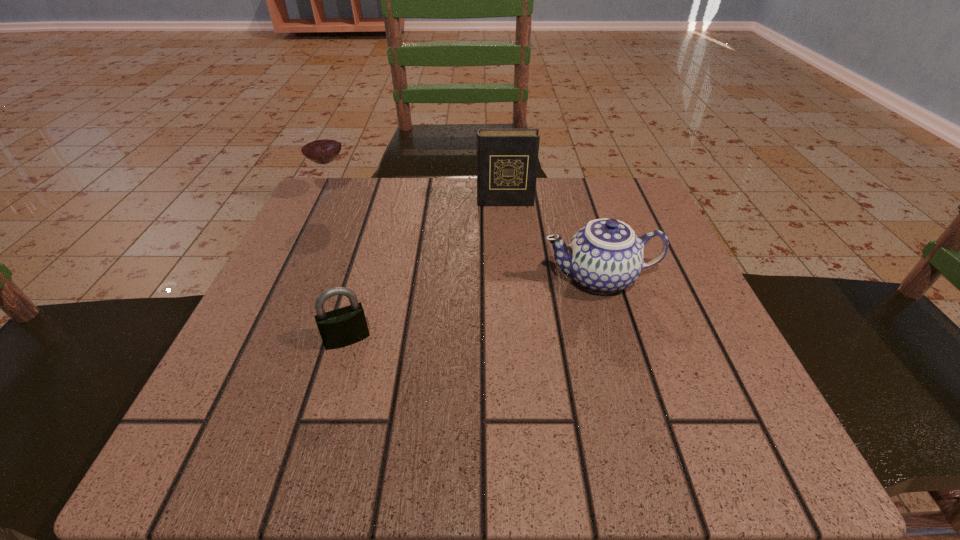
Locate an element on the screen. This screenshot has width=960, height=540. free space between the wineglass and the padlock is located at coordinates (340, 268).

The width and height of the screenshot is (960, 540). I want to click on blank region between the chinaware and the shortest object, so click(473, 308).

Where is `object that can be found as the second closest to the diary`? Image resolution: width=960 pixels, height=540 pixels. object that can be found as the second closest to the diary is located at coordinates (320, 144).

Locate an element on the screen. Image resolution: width=960 pixels, height=540 pixels. object that stands as the second closest to the leftmost object is located at coordinates (345, 326).

This screenshot has width=960, height=540. I want to click on free spot that satisfies the following two spatial constraints: 1. on the front side of the wineglass; 2. on the left side of the nearest object, so point(267,339).

Identify the location of free spot that satisfies the following two spatial constraints: 1. on the front side of the wineglass; 2. on the right side of the padlock. The image size is (960, 540). (267, 339).